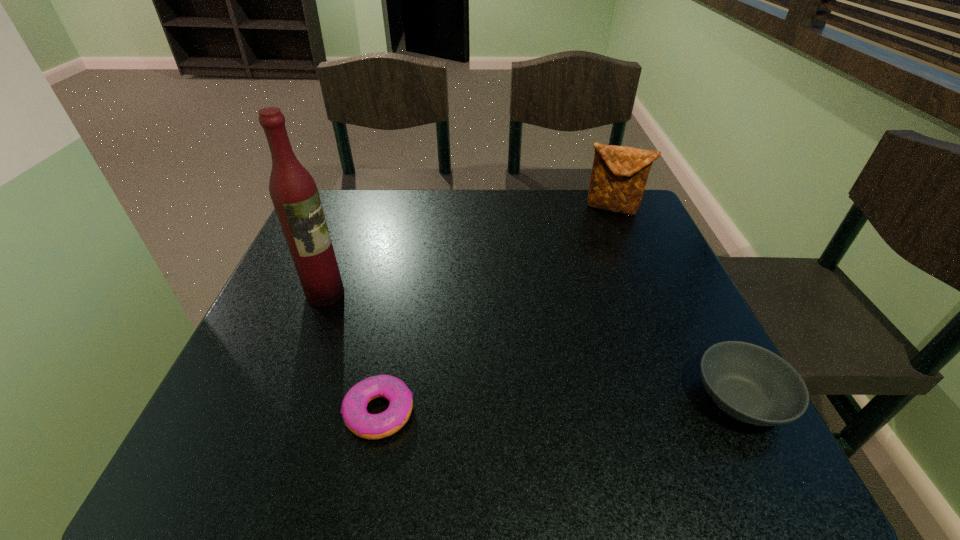
In order to click on clutch bag situated at the right edge in this screenshot , I will do `click(619, 175)`.

Locate an element on the screen. This screenshot has width=960, height=540. object located at the far right corner is located at coordinates (619, 175).

You are a GUI agent. You are given a task and a screenshot of the screen. Output one action in this format:
    pyautogui.click(x=<x>, y=<y>)
    Task: Click on the object positioned at the near right corner
    
    Given the screenshot: What is the action you would take?
    pyautogui.click(x=749, y=383)

Where is `free space at the far edge of the desktop`? The height and width of the screenshot is (540, 960). free space at the far edge of the desktop is located at coordinates (555, 217).

Locate an element on the screen. The image size is (960, 540). vacant space at the near edge of the desktop is located at coordinates (316, 401).

Identify the location of free region at the left edge of the desktop. This screenshot has height=540, width=960. pyautogui.click(x=333, y=240).

At what (x,y) coordinates should I click in order to perform the action: click on free region at the right edge of the desktop. Please return your answer as a coordinate pair (x, y). This screenshot has width=960, height=540. Looking at the image, I should click on (702, 335).

In the image, there is a desktop. Where is `free space at the far left corner`? This screenshot has width=960, height=540. free space at the far left corner is located at coordinates (322, 198).

This screenshot has width=960, height=540. Identify the location of vacant space at the near right corner of the desktop. (680, 380).

This screenshot has height=540, width=960. In order to click on empty space that is in between the third shortest object and the shortest object in this screenshot , I will do `click(496, 310)`.